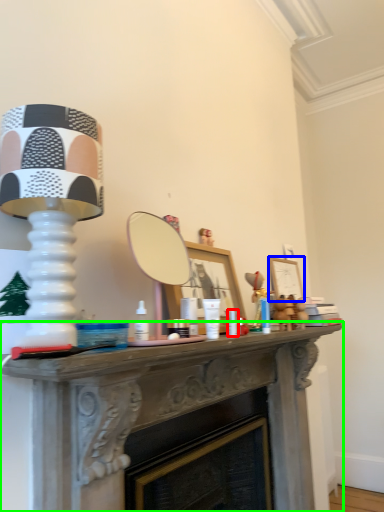
Question: Considering the real-world distances, which object is farthest from toiletry (highlighted by a red box)? picture frame (highlighted by a blue box) or table (highlighted by a green box)?

Choices:
 (A) picture frame
 (B) table

Answer: (A)